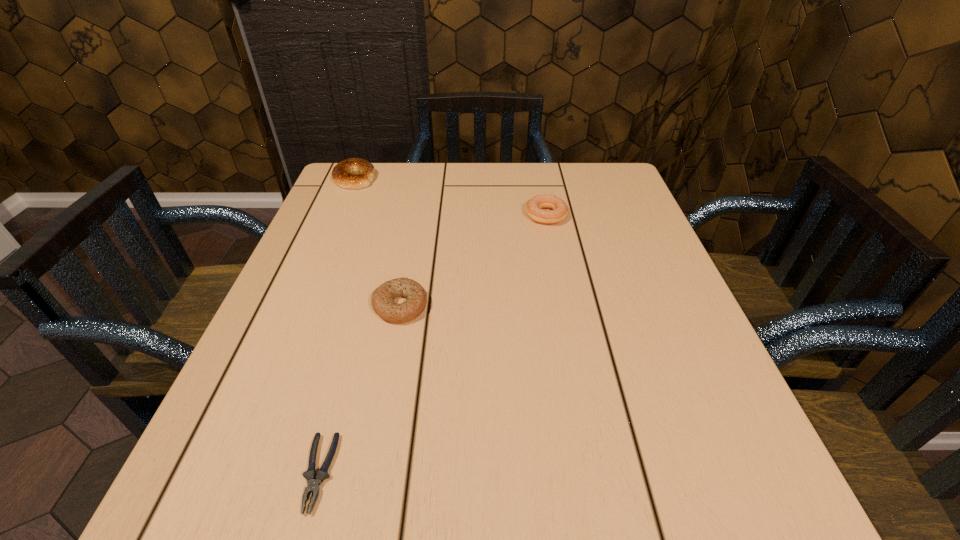
Find the location of a particular element. This screenshot has width=960, height=540. empty location between the farthest bagel and the nearest object is located at coordinates (337, 326).

In order to click on free space between the nearest bagel and the third nearest object in this screenshot , I will do `click(473, 260)`.

You are a GUI agent. You are given a task and a screenshot of the screen. Output one action in this format:
    pyautogui.click(x=<x>, y=<y>)
    Task: Click on the vacant area that lies between the pliers and the second nearest object
    This screenshot has width=960, height=540.
    Given the screenshot: What is the action you would take?
    pyautogui.click(x=359, y=389)

The image size is (960, 540). Find the location of `the second closest object to the nearest bagel`. the second closest object to the nearest bagel is located at coordinates (534, 206).

This screenshot has width=960, height=540. Find the location of `object that ranks as the closest to the pliers`. object that ranks as the closest to the pliers is located at coordinates 383,297.

Locate an element on the screen. This screenshot has height=540, width=960. bagel that is the nearest to the second nearest object is located at coordinates (534, 206).

Select which bagel is the closest to the second bagel from right to left. Please provide its 2D coordinates. Your answer should be formatted as a tuple, i.e. [(x, y)], where the tuple contains the x and y coordinates of a point satisfying the conditions above.

[(534, 206)]